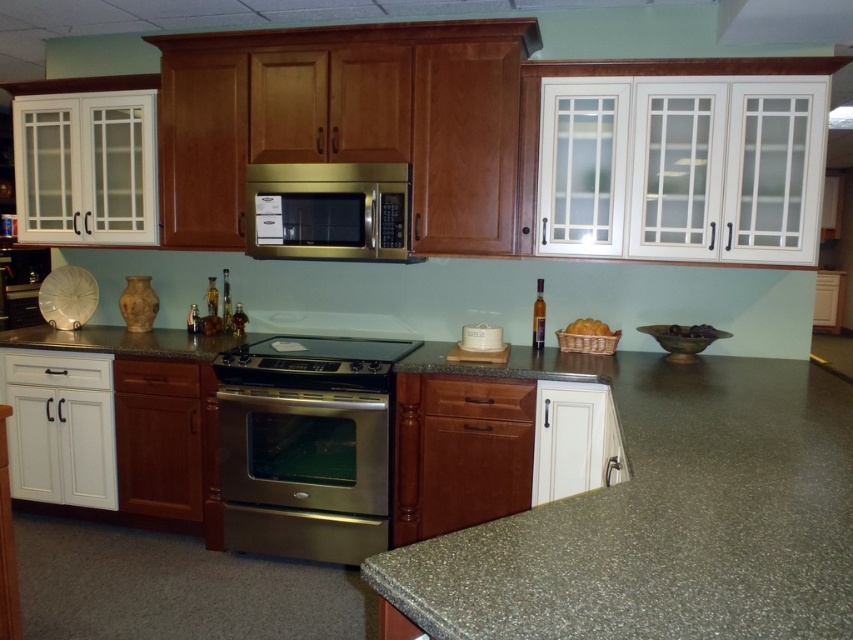
You are a kitchen designer planning to install a new appliance. You have a small microwave that needs to fit below an existing exhaust hood. Looking at the image, can the satin stainless steel exhaust hood at upper center accommodate the microwave beneath it considering the size of the stainless steel stove at center?

The stainless steel stove at center is larger in size than the satin stainless steel exhaust hood at upper center. Since the stove is larger, there might not be enough space below the exhaust hood to fit the microwave, as the stove occupies more area. Therefore, the satin stainless steel exhaust hood at upper center may not have sufficient space beneath it for the microwave.

You are a kitchen designer planning to install a new ventilation system. The stove requires an exhaust hood that must be positioned within 6 feet above it to function effectively. Based on the image, will the satin stainless steel exhaust hood at upper center be positioned correctly above the stainless steel stove at center?

The stainless steel stove at center is 6.79 feet from the satin stainless steel exhaust hood at upper center. Since the required distance is within 6 feet for effective ventilation, the exhaust hood is too far above the stove and needs to be moved closer to meet the requirement.

You are a kitchen designer planning to install a new appliance. You have a granite countertop at center. Where exactly should you place it to align with the existing kitchen layout?

The granite countertop at center should be placed at point coordinates of (631, 516) to align with the existing kitchen layout.